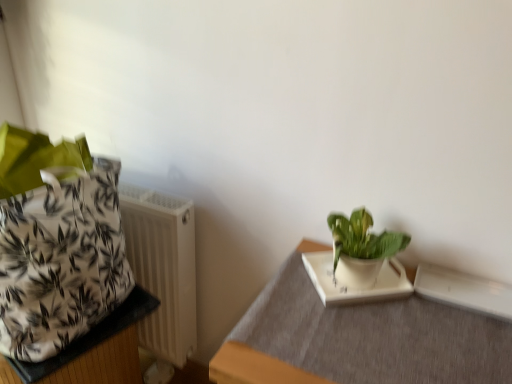
This screenshot has height=384, width=512. I want to click on blank space situated above white matte tray at lower right, which is the second table in left-to-right order (from a real-world perspective), so click(384, 321).